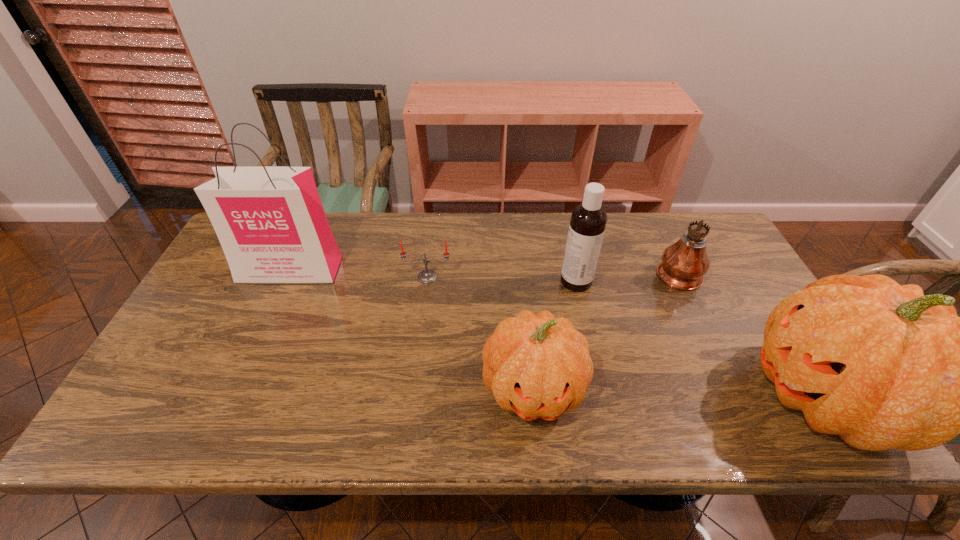
Where is `object that is at the far right corner`? Image resolution: width=960 pixels, height=540 pixels. object that is at the far right corner is located at coordinates (684, 263).

Locate an element on the screen. vacant space at the far edge is located at coordinates (347, 255).

Find the location of a particular element. The height and width of the screenshot is (540, 960). free region at the near edge of the desktop is located at coordinates pyautogui.click(x=364, y=389).

Find the location of a particular element. blank space at the left edge is located at coordinates (229, 291).

At what (x,y) coordinates should I click in order to perform the action: click on free space at the far left corner of the desktop. Please return your answer as a coordinate pair (x, y). Looking at the image, I should click on (225, 255).

Identify the location of free space between the shopping bag and the left pumpkin. (412, 329).

The height and width of the screenshot is (540, 960). I want to click on free space between the fifth tallest object and the tallest object, so click(x=412, y=329).

At what (x,y) coordinates should I click in order to perform the action: click on vacant space that's between the left pumpkin and the oil lamp. Please return your answer as a coordinate pair (x, y). This screenshot has width=960, height=540. Looking at the image, I should click on (605, 330).

Image resolution: width=960 pixels, height=540 pixels. I want to click on unoccupied area between the candle and the tallest object, so click(x=359, y=273).

The height and width of the screenshot is (540, 960). I want to click on empty location between the oil lamp and the dishwasher detergent, so click(627, 276).